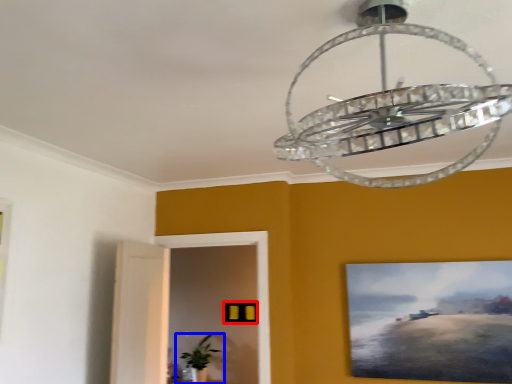
Question: Which object is further to the camera taking this photo, picture frame (highlighted by a red box) or houseplant (highlighted by a blue box)?

Choices:
 (A) picture frame
 (B) houseplant

Answer: (A)